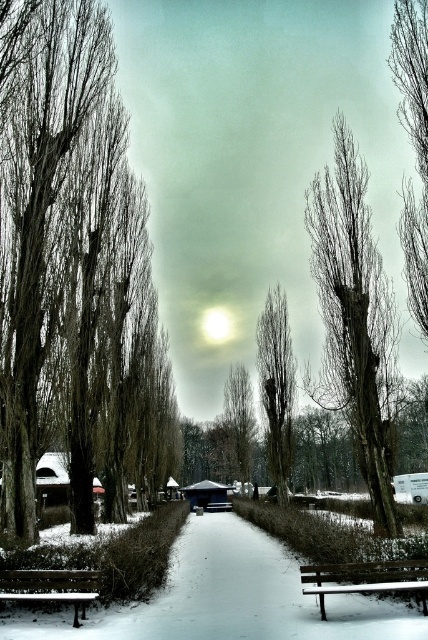
Question: Does bare wood tree at center have a smaller size compared to wooden bench at lower left?

Choices:
 (A) no
 (B) yes

Answer: (A)

Question: Among these objects, which one is farthest from the camera?

Choices:
 (A) smooth bark trees at left
 (B) wooden bench at lower left
 (C) white snow at center
 (D) snow-covered wood bench at lower right

Answer: (A)

Question: Which object is closer to the camera taking this photo?

Choices:
 (A) smooth bark trees at left
 (B) white snow at center
 (C) smooth bark tree at center
 (D) snow-covered wood bench at lower right

Answer: (B)

Question: Does bare wood tree at center appear over smooth bark tree at center?

Choices:
 (A) yes
 (B) no

Answer: (A)

Question: Does snow-covered wood bench at lower right appear under wooden bench at lower left?

Choices:
 (A) yes
 (B) no

Answer: (B)

Question: Which object is positioned closest to the white snow at center?

Choices:
 (A) smooth bark trees at left
 (B) wooden bench at lower left
 (C) bare wood tree at center

Answer: (B)